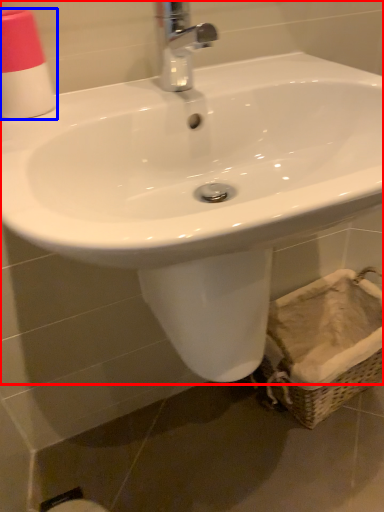
Question: Which of the following is the closest to the observer, sink (highlighted by a red box) or toiletry (highlighted by a blue box)?

Choices:
 (A) sink
 (B) toiletry

Answer: (A)